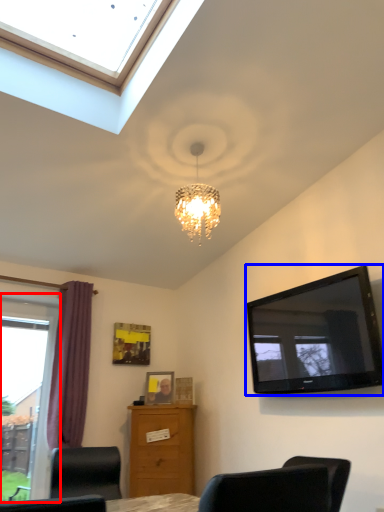
Question: Which object appears closest to the camera in this image, window (highlighted by a red box) or television (highlighted by a blue box)?

Choices:
 (A) window
 (B) television

Answer: (B)